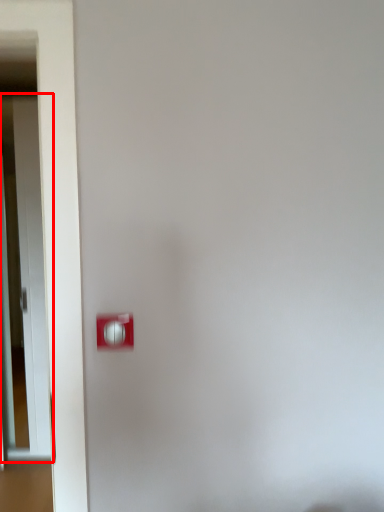
Question: In this image, where is door (annotated by the red box) located relative to light switch?

Choices:
 (A) right
 (B) left

Answer: (B)